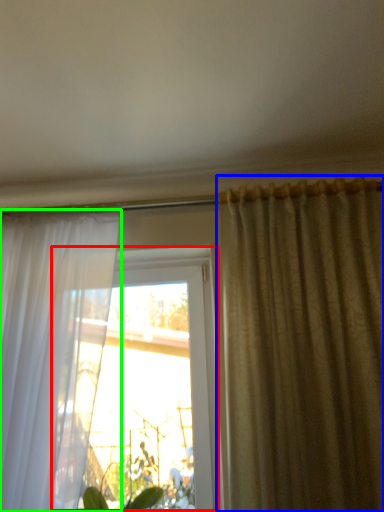
Question: Which is nearer to the window (highlighted by a red box)? curtain (highlighted by a blue box) or curtain (highlighted by a green box).

Choices:
 (A) curtain
 (B) curtain

Answer: (B)